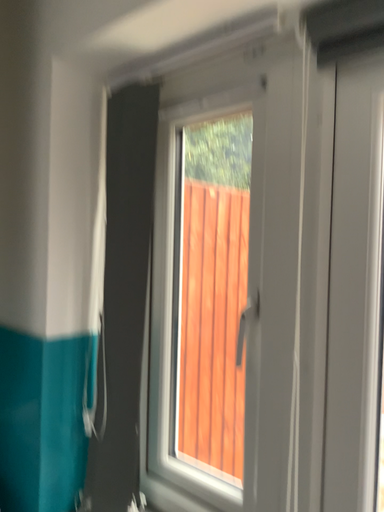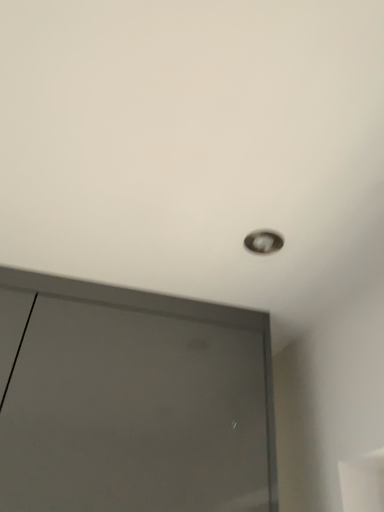
Question: How did the camera likely rotate when shooting the video?

Choices:
 (A) rotated downward
 (B) rotated upward

Answer: (B)